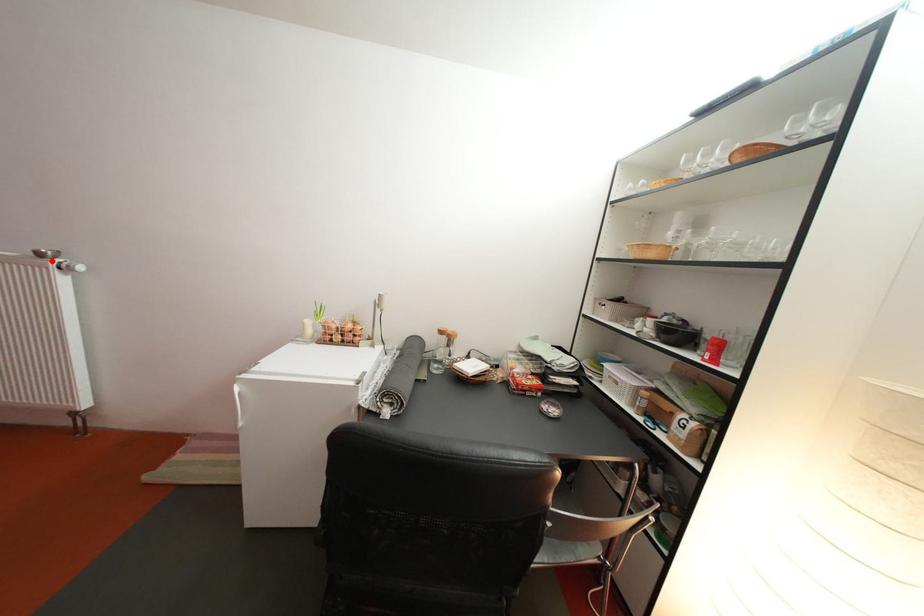
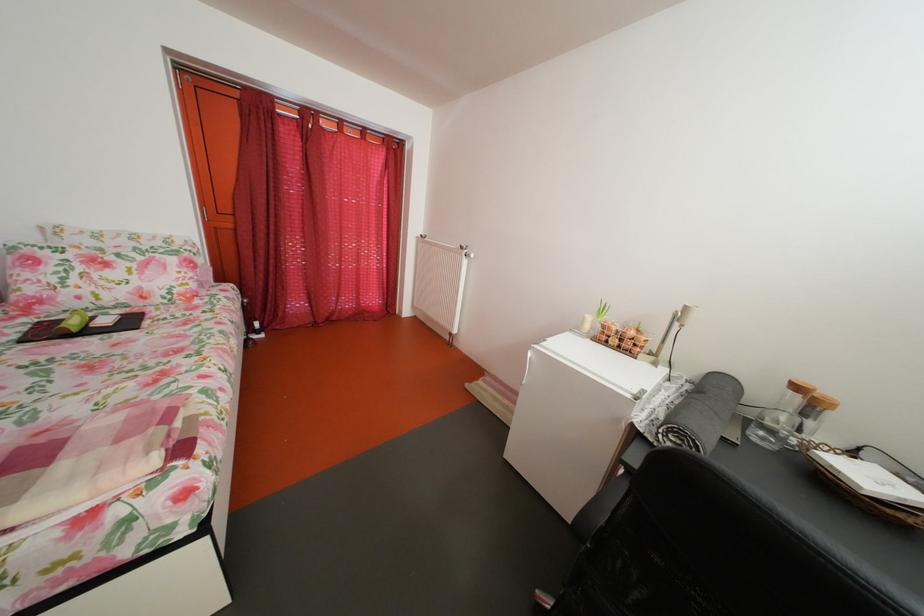
In the second image, find the point that corresponds to the highlighted location in the first image.

(473, 254)